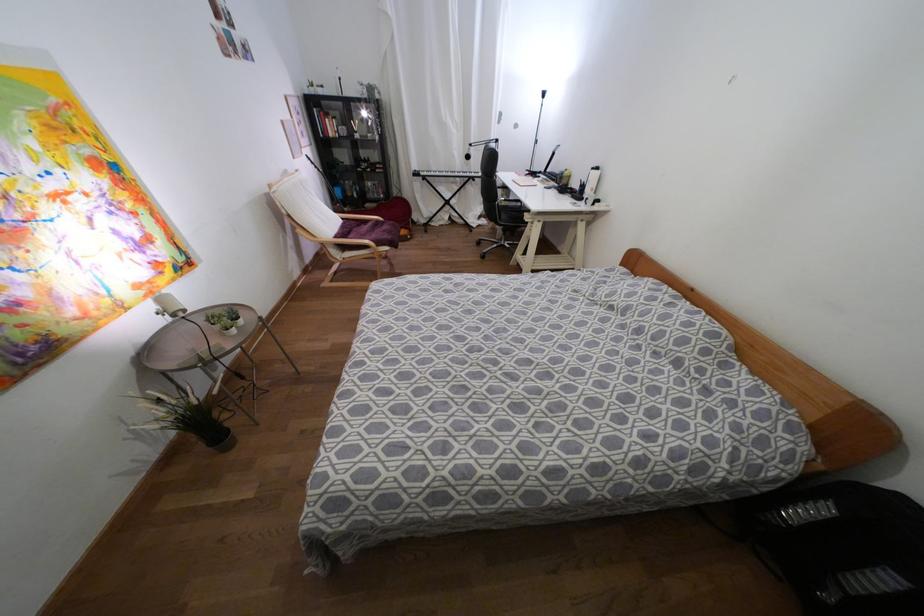
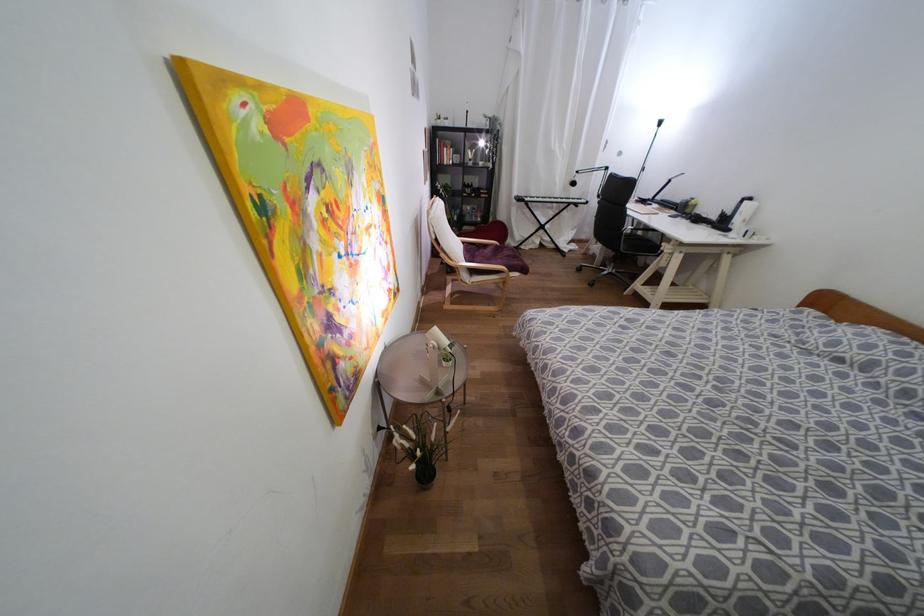
In the second image, find the point that corresponds to pixel 330 134 in the first image.

(444, 161)